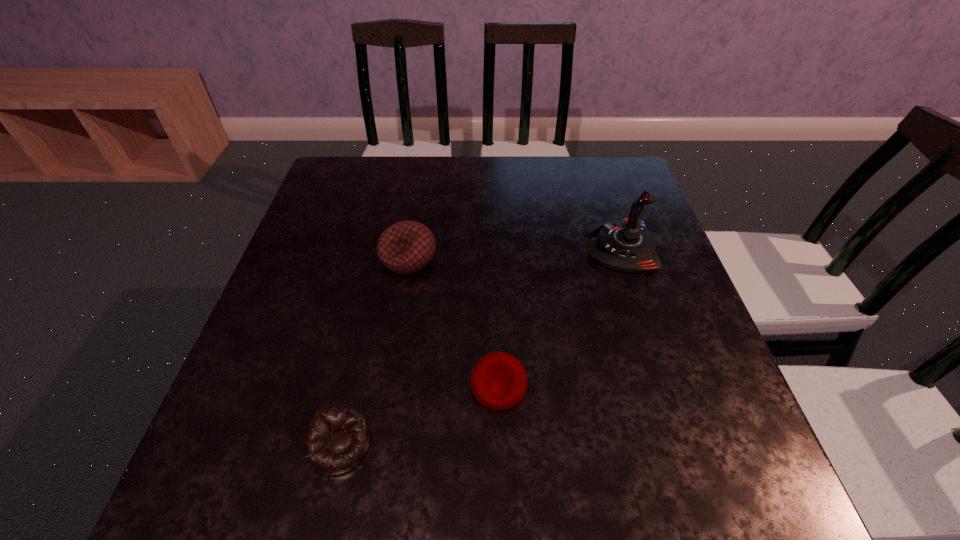
You are a GUI agent. You are given a task and a screenshot of the screen. Output one action in this format:
    pyautogui.click(x=<x>, y=<y>)
    Task: Click on the tallest object
    The width and height of the screenshot is (960, 540).
    Given the screenshot: What is the action you would take?
    click(625, 244)

Find the location of a particular element. the rightmost object is located at coordinates (625, 244).

The height and width of the screenshot is (540, 960). What are the coordinates of `the farthest beanbag` in the screenshot? It's located at (406, 247).

Identify the location of the third shortest object. (406, 247).

Image resolution: width=960 pixels, height=540 pixels. I want to click on the second farthest beanbag, so click(x=499, y=381).

Where is `the third object from left to right`? the third object from left to right is located at coordinates (499, 381).

The height and width of the screenshot is (540, 960). I want to click on the nearest beanbag, so click(x=336, y=439).

In order to click on the shortest object in this screenshot , I will do (x=336, y=439).

At what (x,y) coordinates should I click in order to perform the action: click on free region located on the handle side of the joystick. Please return your answer as a coordinate pair (x, y). Looking at the image, I should click on (483, 246).

You are a GUI agent. You are given a task and a screenshot of the screen. Output one action in this format:
    pyautogui.click(x=<x>, y=<y>)
    Task: Click on the free space located 0.170m on the handle side of the joystick
    Image resolution: width=960 pixels, height=540 pixels.
    Given the screenshot: What is the action you would take?
    pyautogui.click(x=516, y=246)